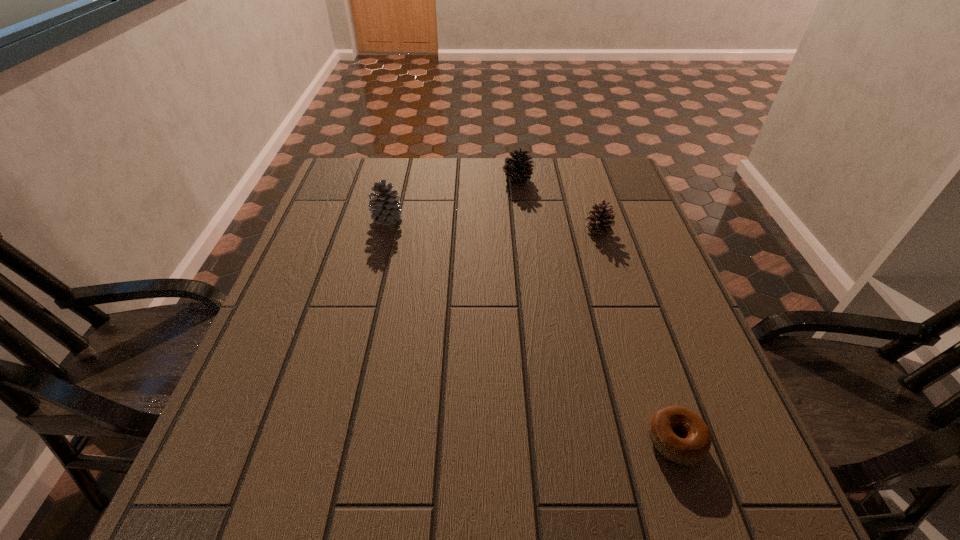
You are a GUI agent. You are given a task and a screenshot of the screen. Output one action in this format:
    pyautogui.click(x=<x>, y=<y>)
    Task: Click on the vacant space at the left edge of the desktop
    This screenshot has height=540, width=960.
    Given the screenshot: What is the action you would take?
    (x=256, y=356)

You are a GUI agent. You are given a task and a screenshot of the screen. Output one action in this format:
    pyautogui.click(x=<x>, y=<y>)
    Task: Click on the free space at the right edge of the desktop
    This screenshot has width=960, height=540.
    Given the screenshot: What is the action you would take?
    pyautogui.click(x=624, y=242)

You are a GUI agent. You are given a task and a screenshot of the screen. Output one action in this format:
    pyautogui.click(x=<x>, y=<y>)
    Task: Click on the free space at the far left corner of the desktop
    
    Given the screenshot: What is the action you would take?
    pyautogui.click(x=338, y=173)

This screenshot has height=540, width=960. What are the coordinates of `vacant space at the near left corner` in the screenshot? It's located at (223, 502).

Where is `empty space that is in between the shortest pinecone and the leftmost pinecone`? empty space that is in between the shortest pinecone and the leftmost pinecone is located at coordinates (492, 224).

You are a GUI agent. You are given a task and a screenshot of the screen. Output one action in this format:
    pyautogui.click(x=<x>, y=<y>)
    Task: Click on the blank region between the nearest object and the second pinecone from left to right
    Image resolution: width=960 pixels, height=540 pixels.
    Given the screenshot: What is the action you would take?
    pyautogui.click(x=596, y=310)

The width and height of the screenshot is (960, 540). Identify the location of free area in between the leftmost pinecone and the rightmost pinecone. (492, 224).

The width and height of the screenshot is (960, 540). What are the coordinates of `vacant area that lies between the leftmost object and the shortest pinecone` in the screenshot? It's located at (492, 224).

Find the location of a particular element. This screenshot has width=960, height=540. free space between the bagel and the farthest object is located at coordinates (596, 310).

Identify the location of vacant area that lies between the bagel and the second shortest object. Image resolution: width=960 pixels, height=540 pixels. (636, 335).